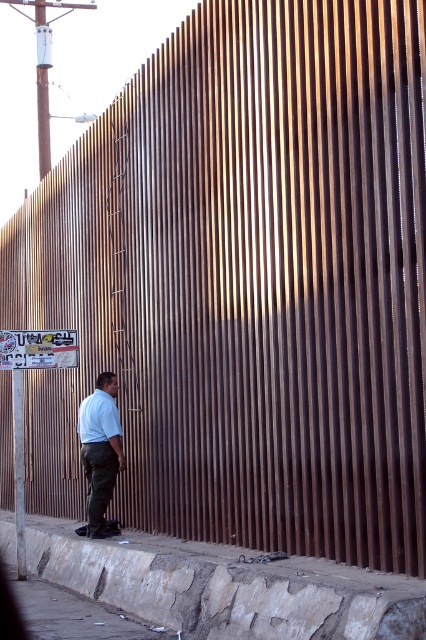
Can you confirm if light blue shirt at center is bigger than white paper street sign at lower left?

Correct, light blue shirt at center is larger in size than white paper street sign at lower left.

Between point (109, 480) and point (3, 358), which one is positioned behind?

Positioned behind is point (3, 358).

Which is behind, point (109, 428) or point (14, 362)?

The point (14, 362) is more distant.

Find the location of a particular element. The image size is (426, 640). light blue shirt at center is located at coordinates (100, 449).

Is light blue shirt at center bigger than metallic gray pole at upper left?

Correct, light blue shirt at center is larger in size than metallic gray pole at upper left.

Consider the image. Can you confirm if light blue shirt at center is positioned below metallic gray pole at upper left?

Yes.

The image size is (426, 640). In order to click on light blue shirt at center in this screenshot , I will do coord(100,449).

At what (x,y) coordinates should I click in order to perform the action: click on light blue shirt at center. Please return your answer as a coordinate pair (x, y). The height and width of the screenshot is (640, 426). Looking at the image, I should click on (100, 449).

In the scene shown: Is gray concrete pavement at lower left to the left of light blue shirt at center from the viewer's perspective?

Correct, you'll find gray concrete pavement at lower left to the left of light blue shirt at center.

What do you see at coordinates (72, 614) in the screenshot? Image resolution: width=426 pixels, height=640 pixels. I see `gray concrete pavement at lower left` at bounding box center [72, 614].

Where is `gray concrete pavement at lower left`? This screenshot has width=426, height=640. gray concrete pavement at lower left is located at coordinates (72, 614).